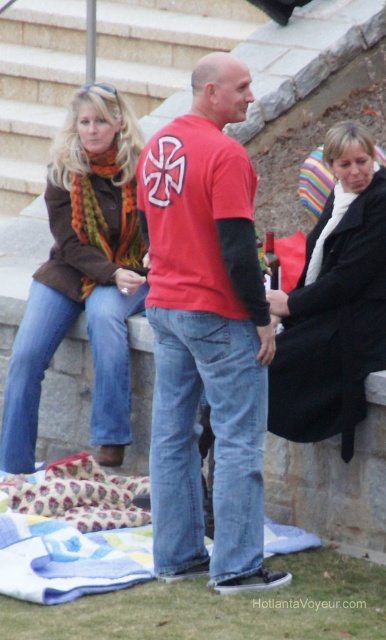
Question: Which of the following is the farthest from the observer?

Choices:
 (A) black wool coat at center
 (B) multicolored scarf at upper left

Answer: (B)

Question: Which object appears farthest from the camera in this image?

Choices:
 (A) multicolored scarf at upper left
 (B) multicolored knitted scarf at left
 (C) matte red t-shirt at center

Answer: (B)

Question: Can you confirm if matte red t-shirt at center is positioned to the right of patterned fabric blanket at lower center?

Choices:
 (A) no
 (B) yes

Answer: (B)

Question: Is black wool coat at center to the right of patterned fabric blanket at lower center from the viewer's perspective?

Choices:
 (A) no
 (B) yes

Answer: (B)

Question: Estimate the real-world distances between objects in this image. Which object is closer to the patterned fabric blanket at lower center?

Choices:
 (A) multicolored knitted scarf at left
 (B) black wool coat at center
 (C) multicolored scarf at upper left

Answer: (C)

Question: Is matte red t-shirt at center to the right of multicolored knitted scarf at left from the viewer's perspective?

Choices:
 (A) yes
 (B) no

Answer: (A)